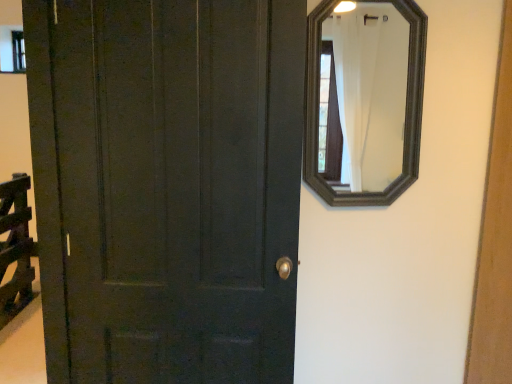
Question: Can you confirm if transparent glass window at upper left is thinner than black wooden mirror at upper right?

Choices:
 (A) yes
 (B) no

Answer: (A)

Question: Can you confirm if transparent glass window at upper left is shorter than black wooden mirror at upper right?

Choices:
 (A) no
 (B) yes

Answer: (B)

Question: From a real-world perspective, is transparent glass window at upper left positioned under black wooden mirror at upper right based on gravity?

Choices:
 (A) no
 (B) yes

Answer: (A)

Question: From the image's perspective, is transparent glass window at upper left located above black wooden mirror at upper right?

Choices:
 (A) yes
 (B) no

Answer: (A)

Question: Is black wooden mirror at upper right completely or partially inside transparent glass window at upper left?

Choices:
 (A) no
 (B) yes

Answer: (A)

Question: Is transparent glass window at upper left oriented away from black wooden mirror at upper right?

Choices:
 (A) no
 (B) yes

Answer: (A)

Question: Is transparent glass window at upper left smaller than matte dark green door at left?

Choices:
 (A) yes
 (B) no

Answer: (A)

Question: Is transparent glass window at upper left not near matte dark green door at left?

Choices:
 (A) yes
 (B) no

Answer: (A)

Question: Does transparent glass window at upper left have a larger size compared to matte dark green door at left?

Choices:
 (A) yes
 (B) no

Answer: (B)

Question: Is transparent glass window at upper left at the right side of matte dark green door at left?

Choices:
 (A) yes
 (B) no

Answer: (B)

Question: From the image's perspective, is transparent glass window at upper left above matte dark green door at left?

Choices:
 (A) yes
 (B) no

Answer: (A)

Question: Is transparent glass window at upper left positioned behind matte dark green door at left?

Choices:
 (A) no
 (B) yes

Answer: (B)

Question: Considering the relative positions of matte dark green door at left and black wooden mirror at upper right in the image provided, is matte dark green door at left behind black wooden mirror at upper right?

Choices:
 (A) no
 (B) yes

Answer: (A)